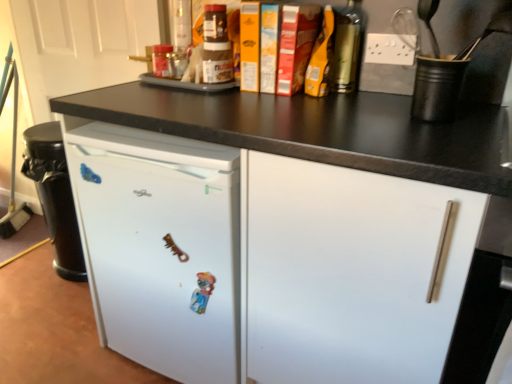
Question: Looking at their shapes, would you say white matte drawer at center is wider or thinner than metallic gold bottle at upper right, which is the first bottle from front to back?

Choices:
 (A) thin
 (B) wide

Answer: (B)

Question: Does point [293, 223] appear closer or farther from the camera than point [339, 69]?

Choices:
 (A) farther
 (B) closer

Answer: (B)

Question: Estimate the real-world distances between objects in this image. Which object is closer to the white matte refrigerator at center?

Choices:
 (A) translucent plastic jar at upper center, the 2th bottle viewed from the right
 (B) black matte cup at upper right
 (C) white matte door at upper left
 (D) white matte drawer at center
 (E) metallic gold bottle at upper right, which is the first bottle from front to back

Answer: (D)

Question: Based on their relative distances, which object is nearer to the black matte cup at upper right?

Choices:
 (A) metallic gold bottle at upper right, placed as the 2th bottle when sorted from back to front
 (B) white matte door at upper left
 (C) white matte drawer at center
 (D) white matte refrigerator at center
 (E) translucent plastic jar at upper center, marked as the 2th bottle in a front-to-back arrangement

Answer: (D)